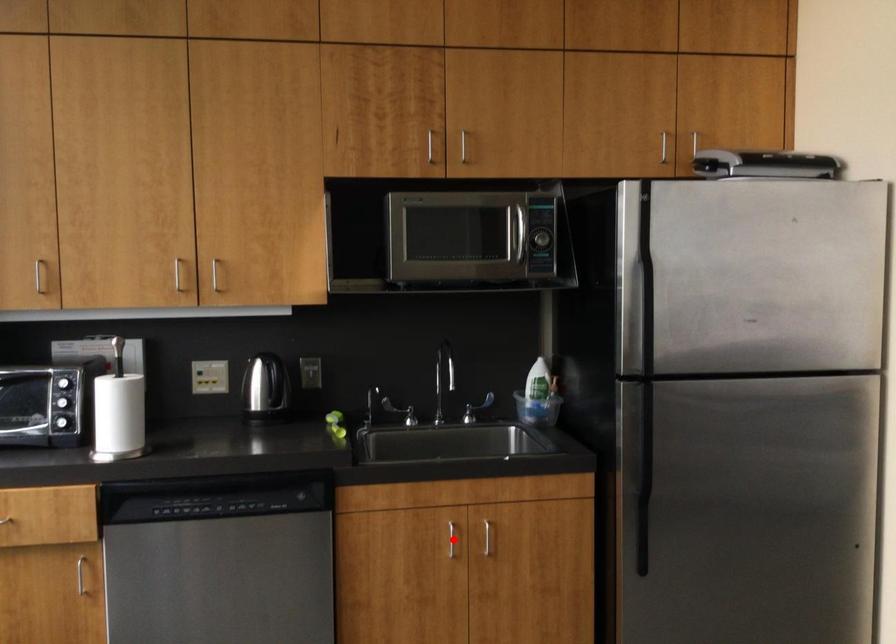
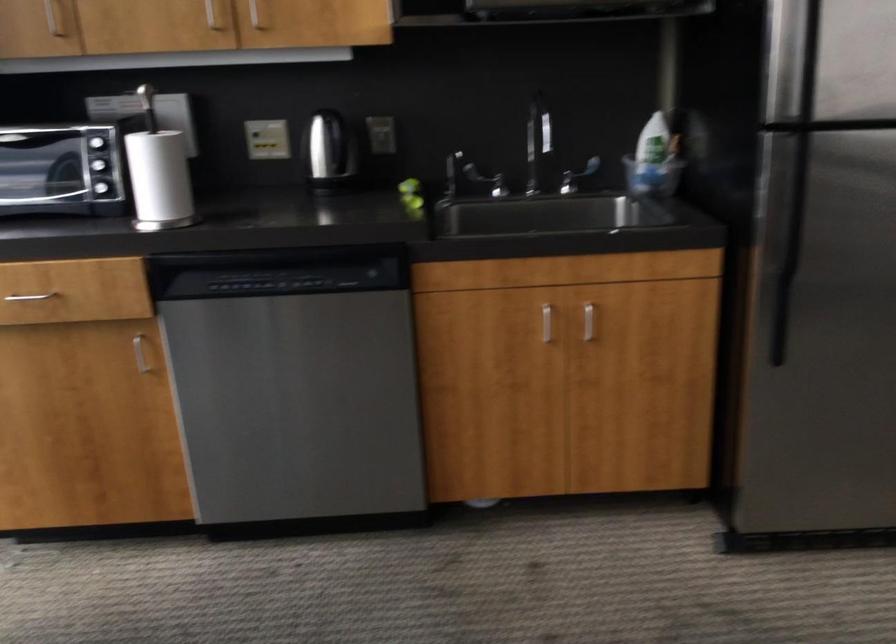
Question: A red point is marked in image1. In image2, is the corresponding 3D point closer to the camera or farther? Reply with the corresponding letter.

Choices:
 (A) The corresponding 3D point is closer.
 (B) The corresponding 3D point is farther.

Answer: (A)